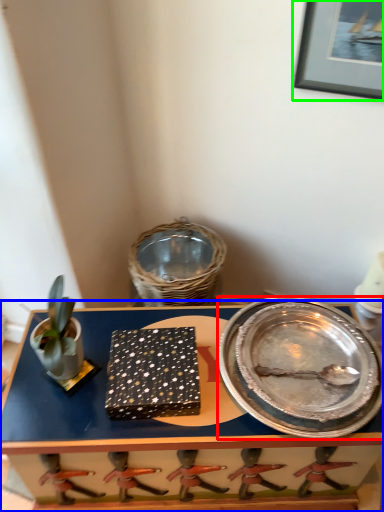
Question: Which object is the farthest from platter (highlighted by a red box)? Choose among these: table (highlighted by a blue box) or picture frame (highlighted by a green box).

Choices:
 (A) table
 (B) picture frame

Answer: (B)